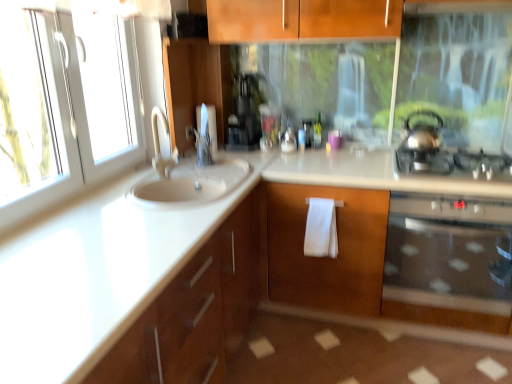
Question: Can you confirm if white cotton bath towel at center is taller than satin silver gas stove at right?

Choices:
 (A) no
 (B) yes

Answer: (B)

Question: Does white cotton bath towel at center have a lesser width compared to satin silver gas stove at right?

Choices:
 (A) yes
 (B) no

Answer: (A)

Question: Considering the relative sizes of white cotton bath towel at center and satin silver gas stove at right in the image provided, is white cotton bath towel at center smaller than satin silver gas stove at right?

Choices:
 (A) no
 (B) yes

Answer: (B)

Question: Considering the relative positions of white cotton bath towel at center and satin silver gas stove at right in the image provided, is white cotton bath towel at center to the right of satin silver gas stove at right from the viewer's perspective?

Choices:
 (A) no
 (B) yes

Answer: (A)

Question: Can you confirm if white cotton bath towel at center is bigger than satin silver gas stove at right?

Choices:
 (A) no
 (B) yes

Answer: (A)

Question: Does white cotton bath towel at center come behind satin silver gas stove at right?

Choices:
 (A) no
 (B) yes

Answer: (B)

Question: Is satin silver gas stove at right further to camera compared to white glossy sink at left?

Choices:
 (A) yes
 (B) no

Answer: (A)

Question: Is white glossy sink at left at the back of satin silver gas stove at right?

Choices:
 (A) yes
 (B) no

Answer: (B)

Question: Does satin silver gas stove at right have a lesser height compared to white glossy sink at left?

Choices:
 (A) no
 (B) yes

Answer: (B)

Question: Is satin silver gas stove at right to the right of white glossy sink at left from the viewer's perspective?

Choices:
 (A) no
 (B) yes

Answer: (B)

Question: Does satin silver gas stove at right have a greater height compared to white glossy sink at left?

Choices:
 (A) no
 (B) yes

Answer: (A)

Question: Is satin silver gas stove at right next to white glossy sink at left and touching it?

Choices:
 (A) yes
 (B) no

Answer: (B)

Question: From a real-world perspective, is white cotton bath towel at center located beneath white glossy toilet paper at upper center?

Choices:
 (A) no
 (B) yes

Answer: (B)